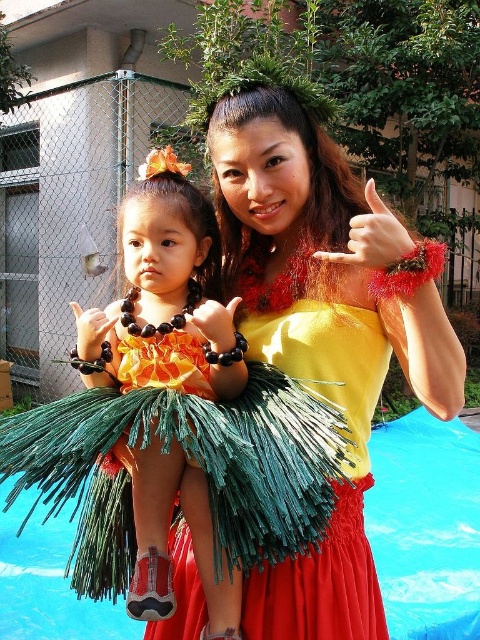
You are a guest at a luau party and see the yellow satin dress at center and blue plastic pool at center. Which one is positioned to the left side?

The yellow satin dress at center is positioned to the left of the blue plastic pool at center.

You are planning to host a small gathering in the backyard. You have an orange fabric dress at center and a blue plastic pool at center. Which item takes up more space in the backyard?

The blue plastic pool at center takes up more space than the orange fabric dress at center because the orange fabric dress at center occupies less space than blue plastic pool at center.

You are standing 1.5 meters away from the camera. Can you reach the point at coordinates point (121, 378) without moving your feet?

The point at coordinates point (121, 378) is 1.19 meters away from the camera. Since you are standing 1.5 meters away from the camera, you are 0.31 meters behind the point. Therefore, you cannot reach it without moving your feet.